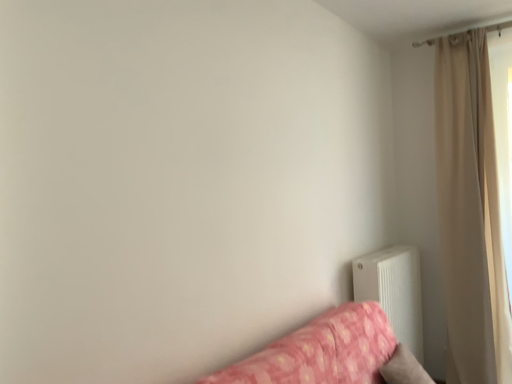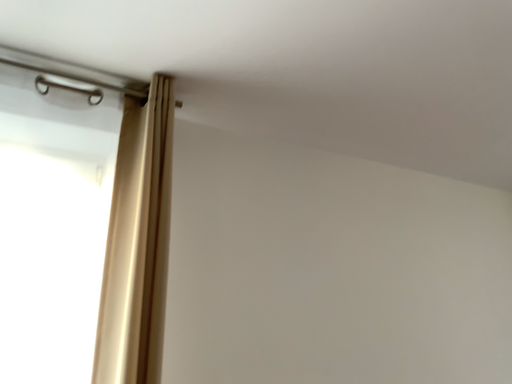
Question: How did the camera likely rotate when shooting the video?

Choices:
 (A) rotated right
 (B) rotated left

Answer: (B)